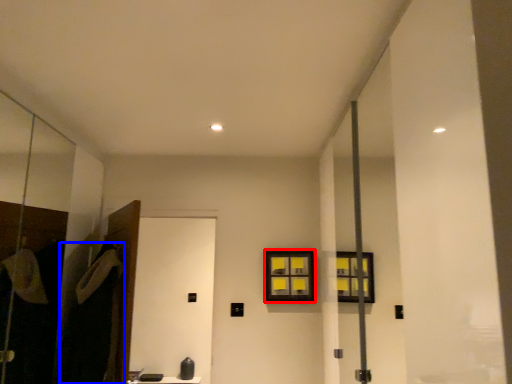
Question: Which object appears closest to the camera in this image, window (highlighted by a red box) or robe (highlighted by a blue box)?

Choices:
 (A) window
 (B) robe

Answer: (B)